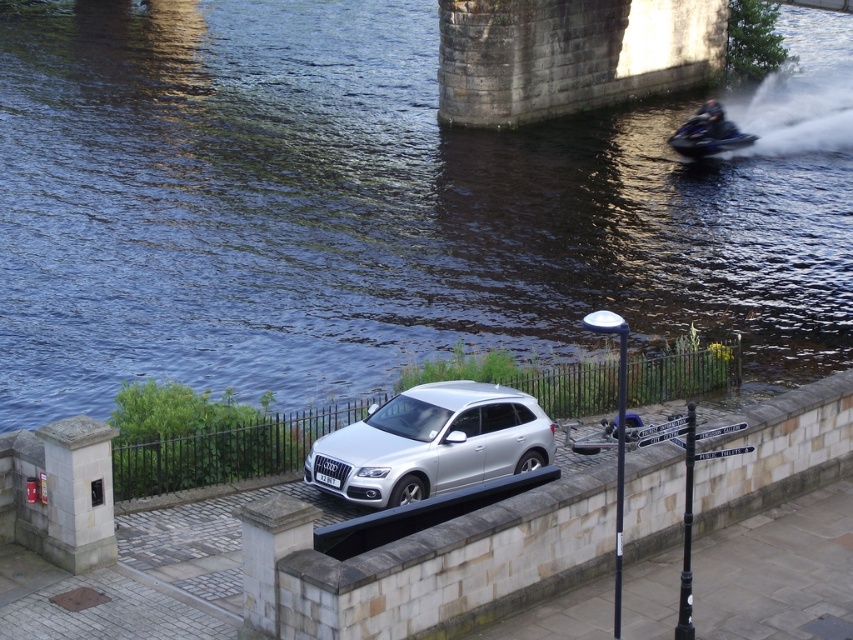
Does satin silver suv at center appear over blue metallic jet ski at upper right?

Incorrect, satin silver suv at center is not positioned above blue metallic jet ski at upper right.

This screenshot has width=853, height=640. What do you see at coordinates (431, 444) in the screenshot?
I see `satin silver suv at center` at bounding box center [431, 444].

Who is more distant from viewer, (352, 474) or (717, 124)?

The point (717, 124) is behind.

Image resolution: width=853 pixels, height=640 pixels. What are the coordinates of `satin silver suv at center` in the screenshot? It's located at (431, 444).

Is point (334, 118) more distant than point (737, 141)?

Yes, point (334, 118) is farther from viewer.

Is point (363, 285) positioned before point (711, 136)?

Yes, it is in front of point (711, 136).

Which is in front, point (660, 211) or point (720, 120)?

Point (660, 211) is more forward.

This screenshot has width=853, height=640. Identify the location of dark blue water at center. (380, 208).

Who is more forward, (486,291) or (334,468)?

Positioned in front is point (334,468).

Is dark blue water at center thinner than satin silver suv at center?

No.

Between point (440, 292) and point (439, 490), which one is positioned behind?

The point (440, 292) is more distant.

This screenshot has width=853, height=640. In order to click on dark blue water at center in this screenshot , I will do `click(380, 208)`.